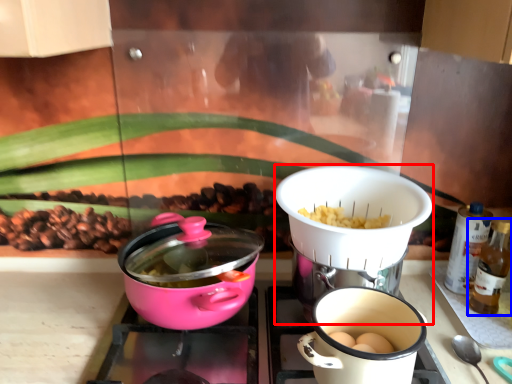
Question: Which object is closer to the camera taking this photo, kitchen appliance (highlighted by a red box) or bottle (highlighted by a blue box)?

Choices:
 (A) kitchen appliance
 (B) bottle

Answer: (A)